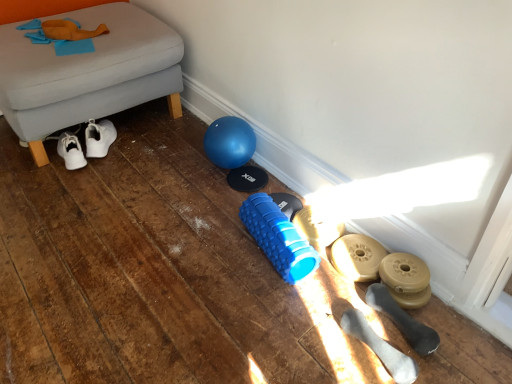
Question: Does matte gold dumbbell at lower right, which appears as the third footwear when viewed from the back, have a smaller size compared to blue rubber foam roller at center?

Choices:
 (A) no
 (B) yes

Answer: (B)

Question: From a real-world perspective, is matte gold dumbbell at lower right, positioned as the third footwear in front-to-back order, physically below blue rubber foam roller at center?

Choices:
 (A) yes
 (B) no

Answer: (A)

Question: Is matte gold dumbbell at lower right, which appears as the third footwear when viewed from the back, in contact with blue rubber foam roller at center?

Choices:
 (A) yes
 (B) no

Answer: (B)

Question: Is matte gold dumbbell at lower right, which appears as the third footwear when viewed from the back, oriented towards blue rubber foam roller at center?

Choices:
 (A) yes
 (B) no

Answer: (B)

Question: Can you confirm if matte gold dumbbell at lower right, which appears as the third footwear when viewed from the back, is shorter than blue rubber foam roller at center?

Choices:
 (A) yes
 (B) no

Answer: (A)

Question: Can you confirm if matte gold dumbbell at lower right, which appears as the third footwear when viewed from the back, is thinner than blue rubber foam roller at center?

Choices:
 (A) no
 (B) yes

Answer: (B)

Question: Can we say matte gold dumbbell at lower right, which appears as the third footwear when viewed from the back, lies outside white rubber dumbbells at lower right, which is the 5th footwear from back to front?

Choices:
 (A) yes
 (B) no

Answer: (A)

Question: From a real-world perspective, is matte gold dumbbell at lower right, which appears as the third footwear when viewed from the back, on white rubber dumbbells at lower right, which is the 5th footwear from back to front?

Choices:
 (A) yes
 (B) no

Answer: (B)

Question: Is matte gold dumbbell at lower right, which appears as the third footwear when viewed from the back, bigger than white rubber dumbbells at lower right, which is the 5th footwear from back to front?

Choices:
 (A) yes
 (B) no

Answer: (B)

Question: From the image's perspective, is matte gold dumbbell at lower right, which appears as the third footwear when viewed from the back, on white rubber dumbbells at lower right, the 1th footwear in the front-to-back sequence?

Choices:
 (A) no
 (B) yes

Answer: (B)

Question: Is matte gold dumbbell at lower right, positioned as the third footwear in front-to-back order, in front of white rubber dumbbells at lower right, which is the 5th footwear from back to front?

Choices:
 (A) yes
 (B) no

Answer: (B)

Question: Does matte gold dumbbell at lower right, which appears as the third footwear when viewed from the back, have a greater width compared to white rubber dumbbells at lower right, the 1th footwear in the front-to-back sequence?

Choices:
 (A) yes
 (B) no

Answer: (A)

Question: Can you confirm if black rubber dumbbell at lower right, which is the second footwear in front-to-back order, is bigger than blue rubber shoe at center, placed as the 1th footwear when sorted from back to front?

Choices:
 (A) no
 (B) yes

Answer: (B)